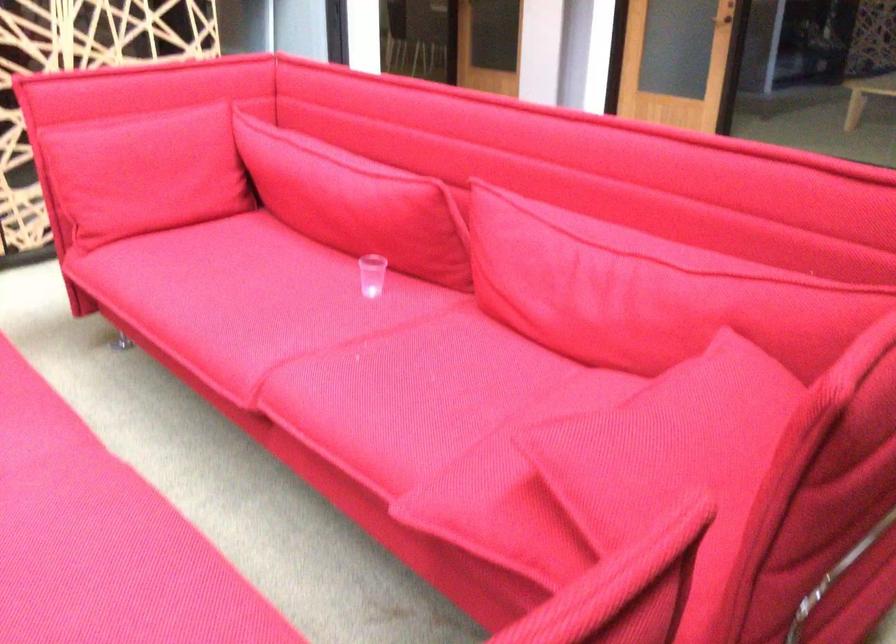
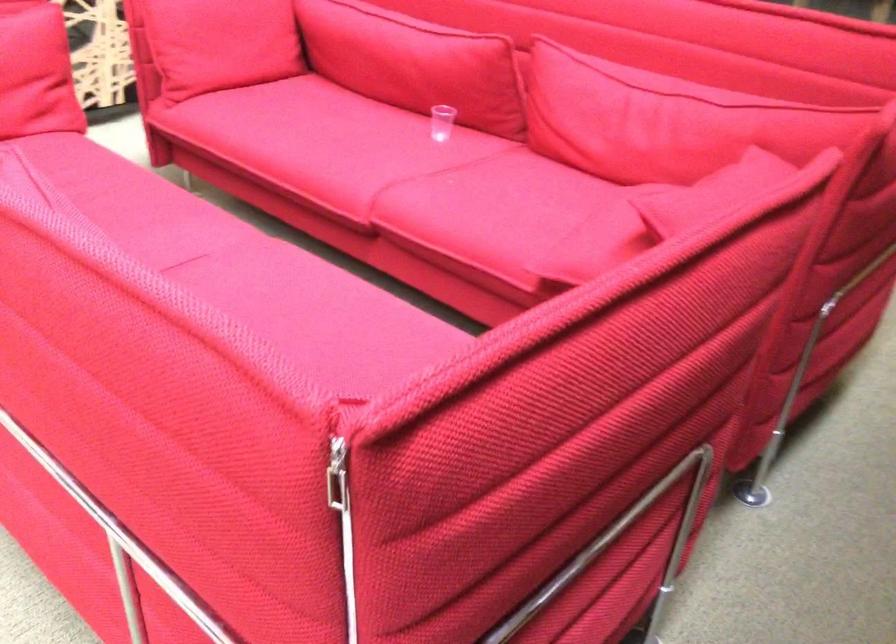
Find the pixel in the second image that matches the point at 142,185 in the first image.

(220, 43)